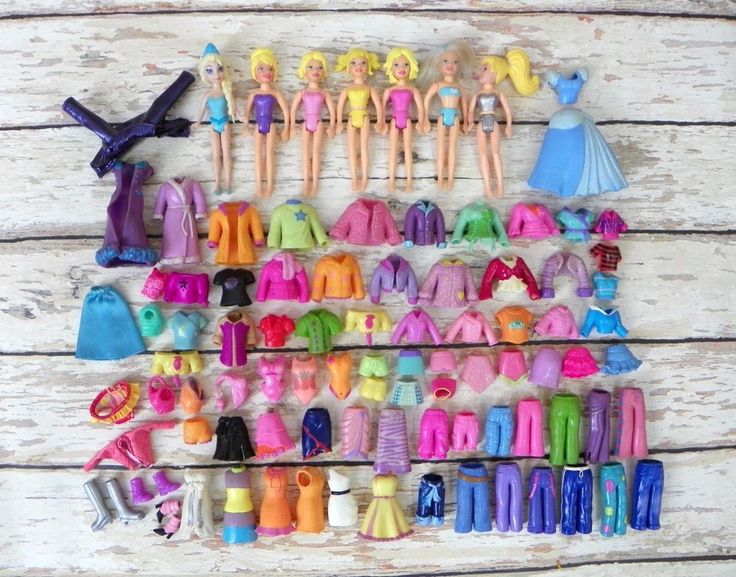
The image size is (736, 577). Identify the location of toy jackets for dolls. pos(233,224), pos(277,275), pos(336,275), pos(389,275), pos(447,278), pos(562,257), pos(470,331), pos(417,325).